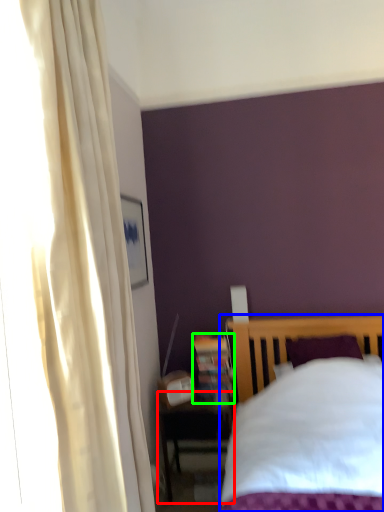
Question: Considering the real-world distances, which object is farthest from nightstand (highlighted by a red box)? bed (highlighted by a blue box) or bookshelf (highlighted by a green box)?

Choices:
 (A) bed
 (B) bookshelf

Answer: (A)